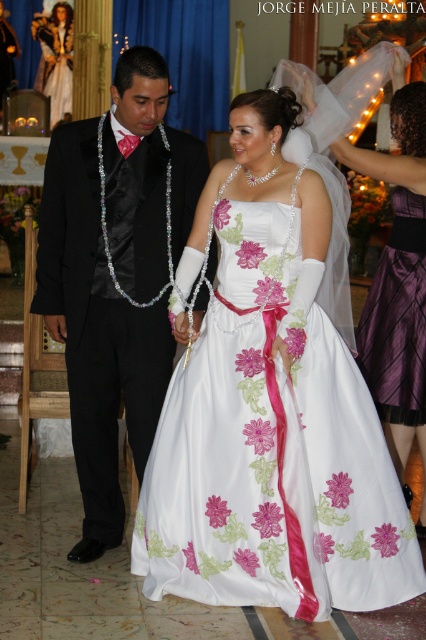
You are a photographer standing behind the couple and need to adjust your camera to focus on both the white satin dress at center and the purple satin skirt at lower right. The camera has a depth of field that can cover 10 centimeters. Can you capture both objects in focus without moving the camera?

The distance between the white satin dress at center and the purple satin skirt at lower right is 9.90 centimeters, which is within the camera depth of field range of 10 centimeters. Therefore, the photographer can capture both objects in focus without moving the camera.

In the wedding scene, you notice the black satin suit at left and the white satin dress at center. Which one is positioned to the left of the other?

The black satin suit at left is positioned to the left of the white satin dress at center.